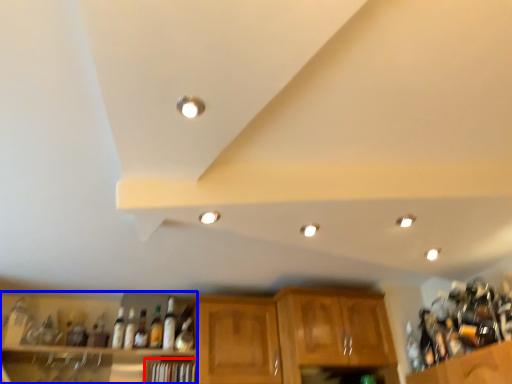
Question: Among these objects, which one is farthest to the camera, shelf (highlighted by a red box) or shelf (highlighted by a blue box)?

Choices:
 (A) shelf
 (B) shelf

Answer: (A)